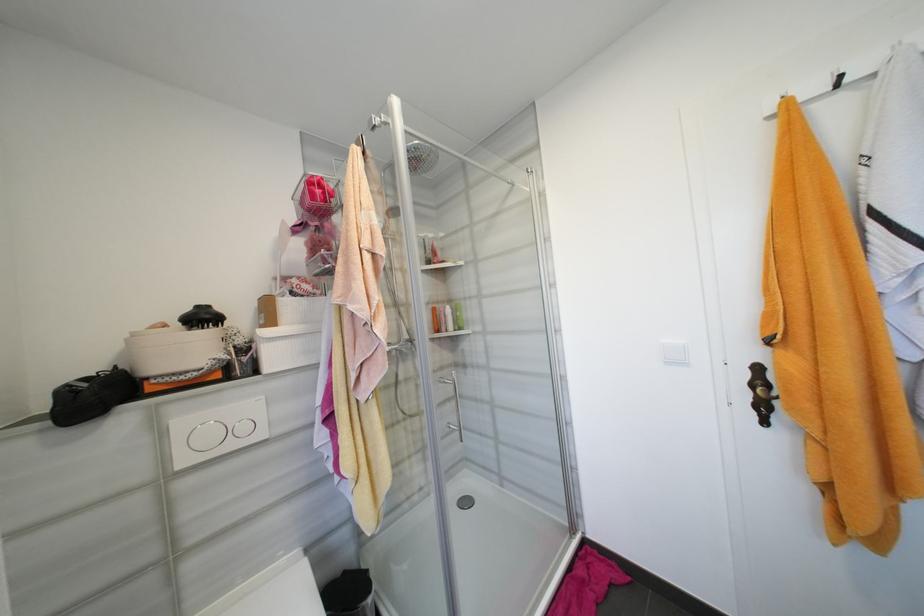
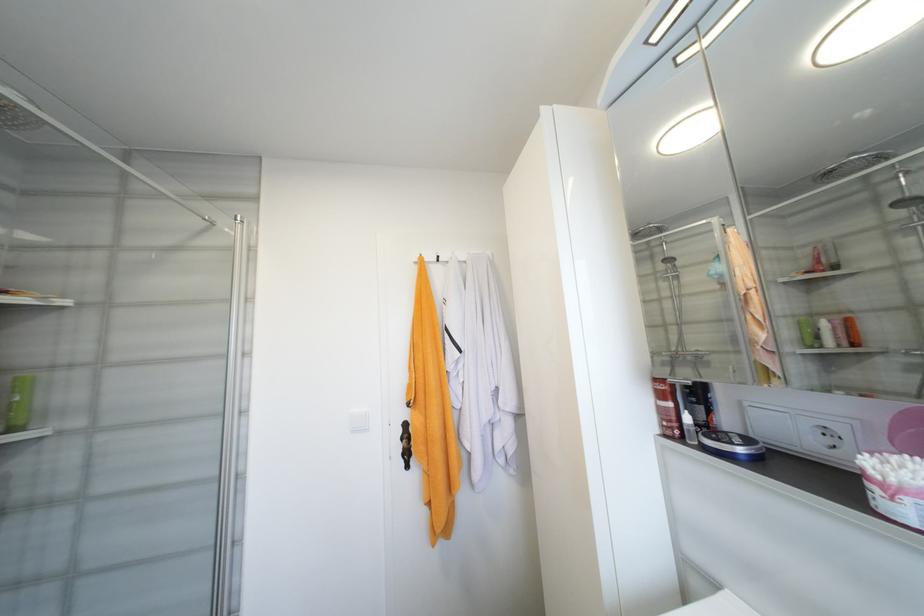
Find the pixel in the second image that matches (x=466, y=330) in the first image.

(19, 430)